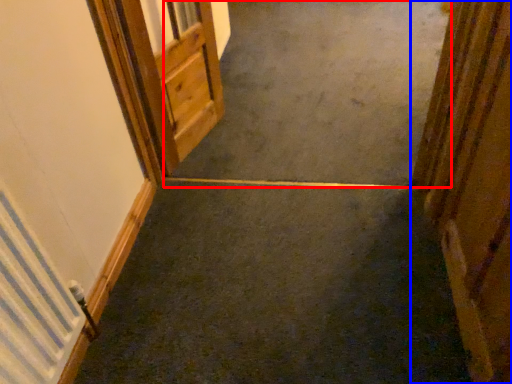
Question: Which point is closer to the camera, concrete (highlighted by a red box) or door (highlighted by a blue box)?

Choices:
 (A) concrete
 (B) door

Answer: (B)